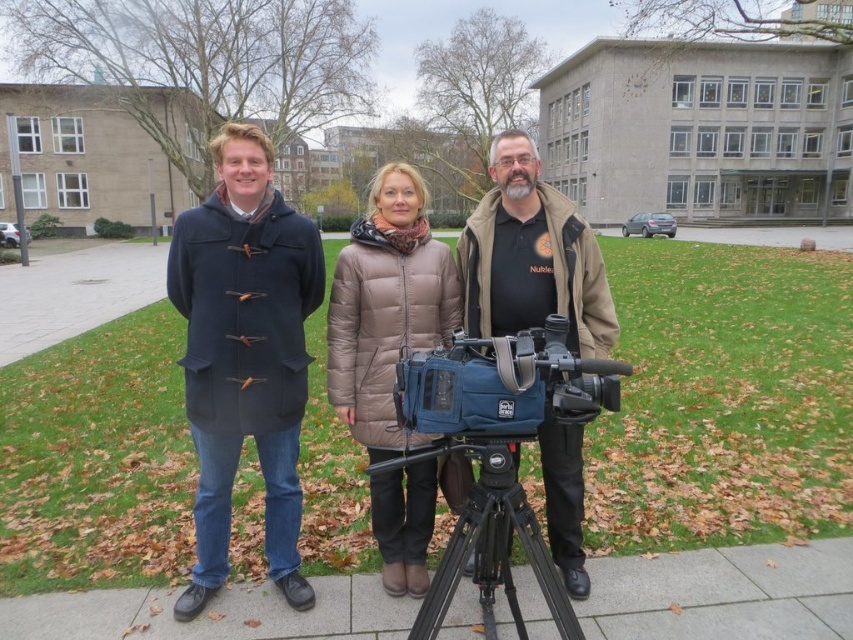
Is point (218, 492) farther from viewer compared to point (544, 342)?

Yes, point (218, 492) is behind point (544, 342).

Does dark blue wool coat at left appear over blue fabric camera at center?

Incorrect, dark blue wool coat at left is not positioned above blue fabric camera at center.

Between point (171, 269) and point (397, 392), which one is positioned behind?

The point (171, 269) is more distant.

Image resolution: width=853 pixels, height=640 pixels. Identify the location of dark blue wool coat at left. (244, 355).

Is point (219, 452) positioned in front of point (480, 557)?

No, it is behind (480, 557).

Does dark blue wool coat at left have a greater height compared to black metal tripod at center?

Correct, dark blue wool coat at left is much taller as black metal tripod at center.

This screenshot has height=640, width=853. Find the location of `dark blue wool coat at left`. dark blue wool coat at left is located at coordinates (244, 355).

I want to click on dark blue wool coat at left, so click(x=244, y=355).

Can you confirm if dark blue wool coat at left is bigger than blue fabric video camera at center?

Indeed, dark blue wool coat at left has a larger size compared to blue fabric video camera at center.

Which is above, dark blue wool coat at left or blue fabric video camera at center?

dark blue wool coat at left is higher up.

I want to click on dark blue wool coat at left, so click(x=244, y=355).